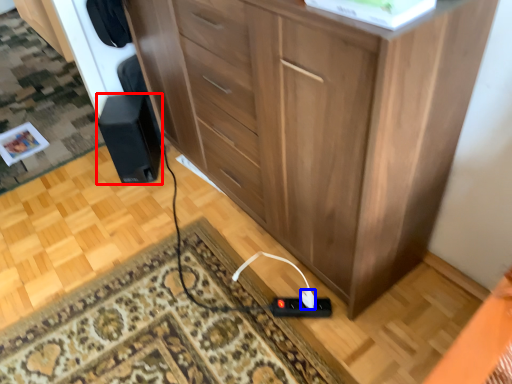
Question: Which object appears farthest to the camera in this image, speaker (highlighted by a red box) or plug (highlighted by a blue box)?

Choices:
 (A) speaker
 (B) plug

Answer: (A)